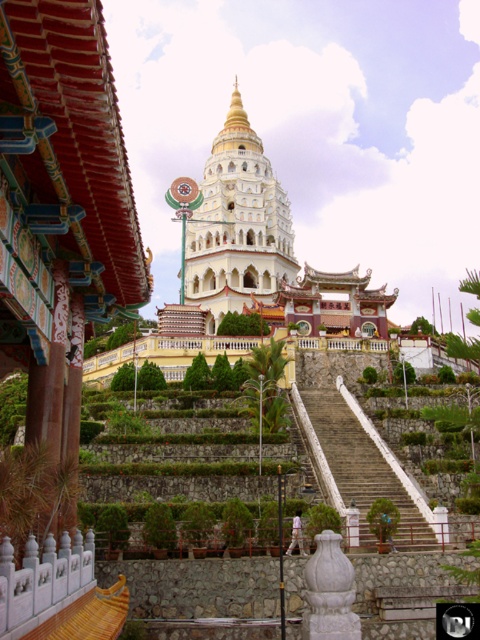
In the image of the temple complex, where is the white stone pagoda at center located in terms of its 2D coordinates?

The white stone pagoda at center is located at coordinates point (238,225).

A drone is flying at a point with coordinates point (228, 141). The drone needs to travel to a point 0.477, 0.223. How far will the drone travel?

The distance between the two points is 154.36 meters.